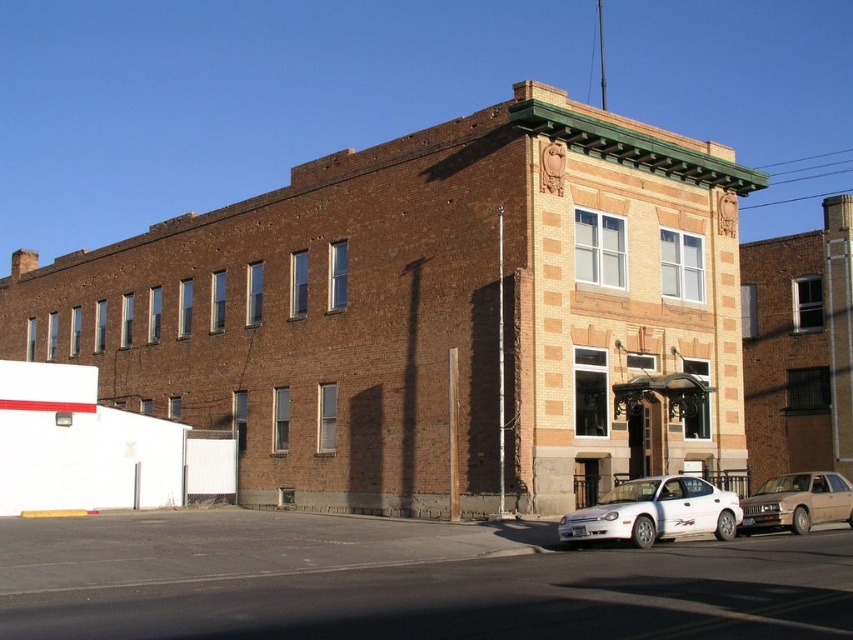
Question: Which point is closer to the camera?

Choices:
 (A) (769, 500)
 (B) (721, 536)

Answer: (B)

Question: Is white matte sedan at lower right positioned behind gold metallic sedan at lower right?

Choices:
 (A) yes
 (B) no

Answer: (B)

Question: Is the position of white matte sedan at lower right less distant than that of gold metallic sedan at lower right?

Choices:
 (A) yes
 (B) no

Answer: (A)

Question: Does white matte sedan at lower right have a greater width compared to gold metallic sedan at lower right?

Choices:
 (A) yes
 (B) no

Answer: (B)

Question: Which point is closer to the camera taking this photo?

Choices:
 (A) pos(778,506)
 (B) pos(634,516)

Answer: (B)